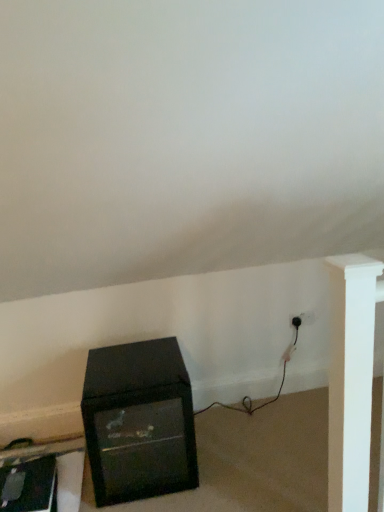
Measure the distance between black plastic plug at lower right and camera.

The depth of black plastic plug at lower right is 7.78 feet.

The width and height of the screenshot is (384, 512). In order to click on black plastic plug at lower right in this screenshot , I will do `click(296, 322)`.

Find the location of a particular element. The image size is (384, 512). black matte cabinet at lower left, which appears as the 1th furniture when viewed from the right is located at coordinates (x=139, y=421).

Can you confirm if black matte cabinet at lower left, which is the 2th furniture in left-to-right order, is taller than black plastic plug at lower right?

Yes, black matte cabinet at lower left, which is the 2th furniture in left-to-right order, is taller than black plastic plug at lower right.

Does point (193, 433) appear closer or farther from the camera than point (299, 319)?

Point (193, 433) is positioned closer to the camera compared to point (299, 319).

In the scene shown: Is black matte cabinet at lower left, which appears as the 1th furniture when viewed from the right, in front of or behind black plastic plug at lower right in the image?

black matte cabinet at lower left, which appears as the 1th furniture when viewed from the right, is positioned closer to the viewer than black plastic plug at lower right.

From a real-world perspective, is black matte cabinet at lower left, which appears as the 1th furniture when viewed from the right, positioned above or below black plastic plug at lower right?

In terms of real-world spatial position, black matte cabinet at lower left, which appears as the 1th furniture when viewed from the right, is below black plastic plug at lower right.

Is black plastic plug at lower right looking in the opposite direction of black matte cabinet at lower left, which is the 2th furniture in left-to-right order?

No, black plastic plug at lower right is not facing the opposite direction of black matte cabinet at lower left, which is the 2th furniture in left-to-right order.

In order to click on the 1st furniture located beneath the black plastic plug at lower right (from a real-world perspective) in this screenshot , I will do `click(139, 421)`.

Is black plastic plug at lower right wider than black matte cabinet at lower left, which is the 2th furniture in left-to-right order?

No, black plastic plug at lower right is not wider than black matte cabinet at lower left, which is the 2th furniture in left-to-right order.

How far apart are black plastic plug at lower right and black matte cabinet at lower left, which appears as the 1th furniture when viewed from the right?

black plastic plug at lower right and black matte cabinet at lower left, which appears as the 1th furniture when viewed from the right, are 3.33 feet apart.

In the image, is black glossy tv at lower left, acting as the first furniture starting from the left, positioned in front of or behind black matte cabinet at lower left, which appears as the 1th furniture when viewed from the right?

black glossy tv at lower left, acting as the first furniture starting from the left, is positioned farther from the viewer than black matte cabinet at lower left, which appears as the 1th furniture when viewed from the right.

Considering the relative sizes of black glossy tv at lower left, acting as the first furniture starting from the left, and black matte cabinet at lower left, which is the 2th furniture in left-to-right order, in the image provided, is black glossy tv at lower left, acting as the first furniture starting from the left, bigger than black matte cabinet at lower left, which is the 2th furniture in left-to-right order,?

No, black glossy tv at lower left, acting as the first furniture starting from the left, is not bigger than black matte cabinet at lower left, which is the 2th furniture in left-to-right order.

From a real-world perspective, is black glossy tv at lower left, acting as the first furniture starting from the left, over black matte cabinet at lower left, which is the 2th furniture in left-to-right order?

No.

Locate an element on the screen. This screenshot has width=384, height=512. furniture above the black glossy tv at lower left, acting as the first furniture starting from the left (from the image's perspective) is located at coordinates (139, 421).

Does point (110, 375) come behind point (64, 507)?

Yes, it is behind point (64, 507).

Considering the relative sizes of black matte cabinet at lower left, which appears as the 1th furniture when viewed from the right, and black glossy tv at lower left, which appears as the second furniture when viewed from the right, in the image provided, is black matte cabinet at lower left, which appears as the 1th furniture when viewed from the right, wider than black glossy tv at lower left, which appears as the second furniture when viewed from the right,?

No.

Is black glossy tv at lower left, acting as the first furniture starting from the left, at the back of black matte cabinet at lower left, which appears as the 1th furniture when viewed from the right?

No, black matte cabinet at lower left, which appears as the 1th furniture when viewed from the right,'s orientation is not away from black glossy tv at lower left, acting as the first furniture starting from the left.

Considering the sizes of objects black glossy tv at lower left, which appears as the second furniture when viewed from the right, and black plastic plug at lower right in the image provided, who is smaller, black glossy tv at lower left, which appears as the second furniture when viewed from the right, or black plastic plug at lower right?

Smaller between the two is black plastic plug at lower right.

Would you say black plastic plug at lower right is part of black glossy tv at lower left, which appears as the second furniture when viewed from the right,'s contents?

Definitely not — black plastic plug at lower right is not inside black glossy tv at lower left, which appears as the second furniture when viewed from the right.

From the image's perspective, between black glossy tv at lower left, which appears as the second furniture when viewed from the right, and black plastic plug at lower right, which one is located above?

black plastic plug at lower right, from the image's perspective.

Is black glossy tv at lower left, which appears as the second furniture when viewed from the right, not near black plastic plug at lower right?

Yes, black glossy tv at lower left, which appears as the second furniture when viewed from the right, and black plastic plug at lower right are located far from each other.

From a real-world perspective, which object stands above the other?

From a 3D spatial view, black plastic plug at lower right is above.

Does black plastic plug at lower right come behind black glossy tv at lower left, which appears as the second furniture when viewed from the right?

Yes, it is.

Is black plastic plug at lower right oriented towards black glossy tv at lower left, which appears as the second furniture when viewed from the right?

No.

Is black plastic plug at lower right far from black glossy tv at lower left, which appears as the second furniture when viewed from the right?

That's right, there is a large distance between black plastic plug at lower right and black glossy tv at lower left, which appears as the second furniture when viewed from the right.

Image resolution: width=384 pixels, height=512 pixels. What are the coordinates of `plug that appears behind the black matte cabinet at lower left, which appears as the 1th furniture when viewed from the right` in the screenshot? It's located at (296, 322).

At what (x,y) coordinates should I click in order to perform the action: click on the 2nd furniture in front of the black plastic plug at lower right. Please return your answer as a coordinate pair (x, y). The width and height of the screenshot is (384, 512). Looking at the image, I should click on (139, 421).

Which object lies nearer to the anchor point black matte cabinet at lower left, which is the 2th furniture in left-to-right order, black glossy tv at lower left, acting as the first furniture starting from the left, or black plastic plug at lower right?

black glossy tv at lower left, acting as the first furniture starting from the left.

Which object lies nearer to the anchor point black glossy tv at lower left, acting as the first furniture starting from the left, black matte cabinet at lower left, which is the 2th furniture in left-to-right order, or black plastic plug at lower right?

Among the two, black matte cabinet at lower left, which is the 2th furniture in left-to-right order, is located nearer to black glossy tv at lower left, acting as the first furniture starting from the left.

From the image, which object appears to be nearer to black matte cabinet at lower left, which appears as the 1th furniture when viewed from the right, black plastic plug at lower right or black glossy tv at lower left, acting as the first furniture starting from the left?

black glossy tv at lower left, acting as the first furniture starting from the left, is closer to black matte cabinet at lower left, which appears as the 1th furniture when viewed from the right.

Which object lies nearer to the anchor point black plastic plug at lower right, black glossy tv at lower left, which appears as the second furniture when viewed from the right, or black matte cabinet at lower left, which is the 2th furniture in left-to-right order?

Based on the image, black matte cabinet at lower left, which is the 2th furniture in left-to-right order, appears to be nearer to black plastic plug at lower right.

From the image, which object appears to be nearer to black glossy tv at lower left, acting as the first furniture starting from the left, black plastic plug at lower right or black matte cabinet at lower left, which appears as the 1th furniture when viewed from the right?

Among the two, black matte cabinet at lower left, which appears as the 1th furniture when viewed from the right, is located nearer to black glossy tv at lower left, acting as the first furniture starting from the left.

Looking at the image, which one is located further to black plastic plug at lower right, black matte cabinet at lower left, which is the 2th furniture in left-to-right order, or black glossy tv at lower left, acting as the first furniture starting from the left?

black glossy tv at lower left, acting as the first furniture starting from the left.

Identify the location of furniture located between black glossy tv at lower left, acting as the first furniture starting from the left, and black plastic plug at lower right in the left-right direction. This screenshot has width=384, height=512. (139, 421).